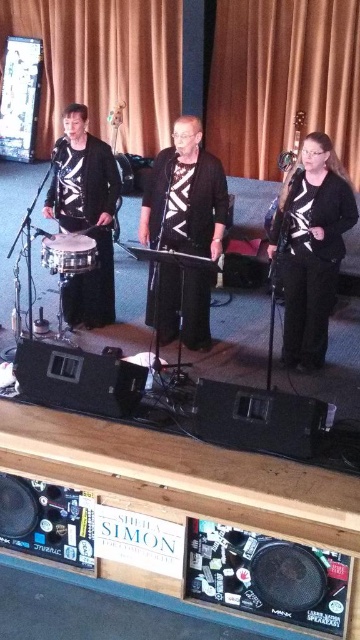
Question: Which object is closer to the camera taking this photo?

Choices:
 (A) matte silver drum at left
 (B) black matte jacket at center

Answer: (A)

Question: Is black matte jacket at center above matte black drum at left?

Choices:
 (A) no
 (B) yes

Answer: (A)

Question: Is black matte guitar at right further to camera compared to matte black drum at left?

Choices:
 (A) yes
 (B) no

Answer: (B)

Question: Which object is positioned closest to the black matte jacket at center?

Choices:
 (A) matte silver drum at left
 (B) matte black drum at left

Answer: (B)

Question: Is black matte jacket at center positioned at the back of matte black drum at left?

Choices:
 (A) no
 (B) yes

Answer: (A)

Question: Which object is closer to the camera taking this photo?

Choices:
 (A) black matte jacket at center
 (B) matte black drum at left
 (C) black matte guitar at right
 (D) matte silver drum at left

Answer: (C)